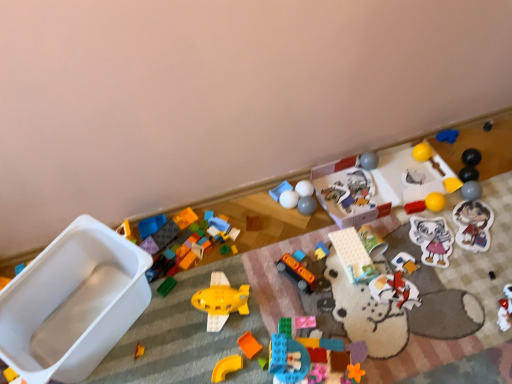
The height and width of the screenshot is (384, 512). Find the location of `vacant area that lies between white glossy sticker at center-right, which is counted as the sixth toy, starting from the right, and yellow plastic airplane at center, the 22th toy in the right-to-left sequence`. vacant area that lies between white glossy sticker at center-right, which is counted as the sixth toy, starting from the right, and yellow plastic airplane at center, the 22th toy in the right-to-left sequence is located at coordinates (331, 283).